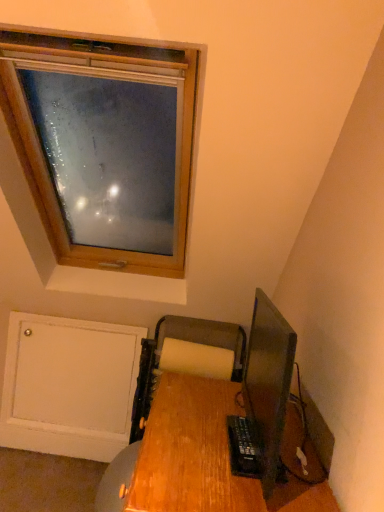
The width and height of the screenshot is (384, 512). What are the coordinates of `free space above wooden desk at lower right (from a real-world perspective)` in the screenshot? It's located at (205, 426).